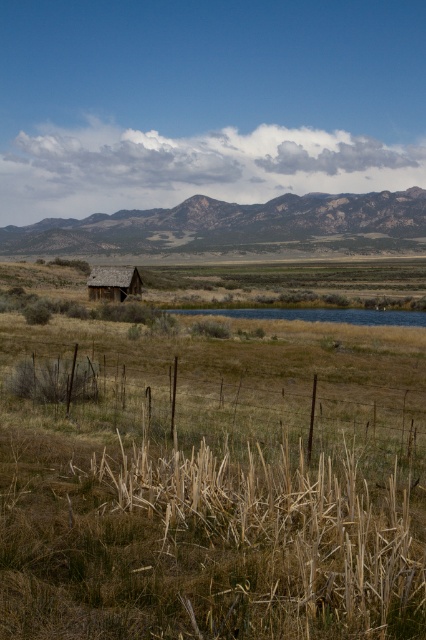
Question: Among these objects, which one is nearest to the camera?

Choices:
 (A) rocky brown mountain at center
 (B) brown wooden hut at left

Answer: (B)

Question: Can you confirm if rocky brown mountain at center is wider than brown wooden hut at left?

Choices:
 (A) yes
 (B) no

Answer: (A)

Question: Is rocky brown mountain at center bigger than brown wooden hut at left?

Choices:
 (A) yes
 (B) no

Answer: (A)

Question: Can you confirm if rocky brown mountain at center is positioned to the right of brown wooden hut at left?

Choices:
 (A) yes
 (B) no

Answer: (A)

Question: Among these points, which one is nearest to the camera?

Choices:
 (A) (103, 268)
 (B) (85, 232)

Answer: (A)